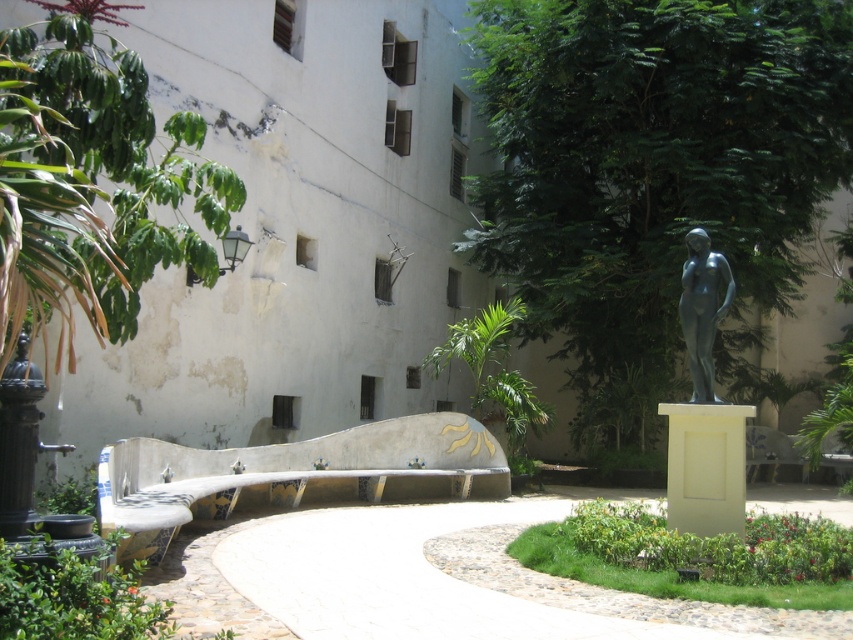
You are a visitor in the courtyard and want to sit on the green grass at center. However, there is a green leafy tree at center. Can you sit under the tree without stepping on the grass?

The green leafy tree at center is located above green grass at center, so you can sit under the tree without stepping on the grass since the tree is above the grass and you can sit on the grass area beneath it.

You are standing in the courtyard and want to determine which of the two points, point (41, 65) or point (724, 268), is closer to you. Based on the scene, which point is nearer?

Point (41, 65) is closer to the viewer than point (724, 268).

You are standing in the courtyard and want to take a photo of the statue of a nude female figure on the right. To avoid including the green leafy plant at upper left in your photo, should you move closer to or farther away from the statue?

To avoid including the green leafy plant at upper left in your photo, you should move closer to the statue. Since the plant is located at coordinates closer to the upper left corner, moving closer to the statue would reduce the field of view, making it less likely to capture the plant in the frame.